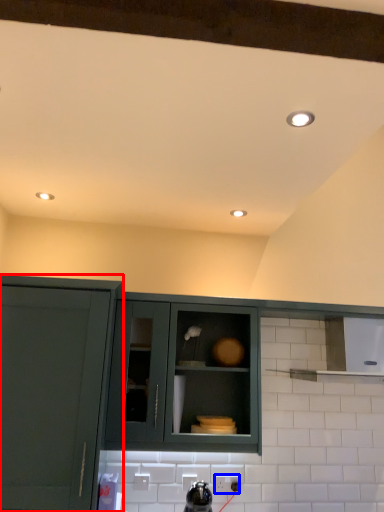
Question: Which of the following is the closest to the observer, cabinetry (highlighted by a red box) or electric outlet (highlighted by a blue box)?

Choices:
 (A) cabinetry
 (B) electric outlet

Answer: (A)